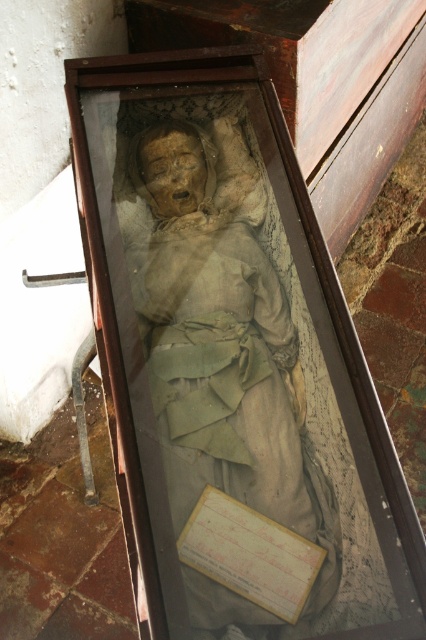
You are a conservator examining the mummy display. The matte brown statue at center and the yellow paper at center are both part of the exhibit. Which object is taller?

The matte brown statue at center is taller than the yellow paper at center.

Looking at this image, you are a tour guide standing 1.5 meters away from a matte brown statue at center. Can you safely approach the statue to give a detailed explanation to the visitors?

The matte brown statue at center is 1.48 meters away from the viewer, so you are currently standing closer than 1.5 meters. To safely approach, you need to maintain at least 1.5 meters distance. Therefore, you should step back slightly to ensure the distance remains safe.

You are an archaeologist examining the mummy case. You notice two points marked on the case. Which point is closer to you, point (x=204, y=611) or point (x=270, y=525)?

Point (x=204, y=611) is closer to the viewer than point (x=270, y=525).